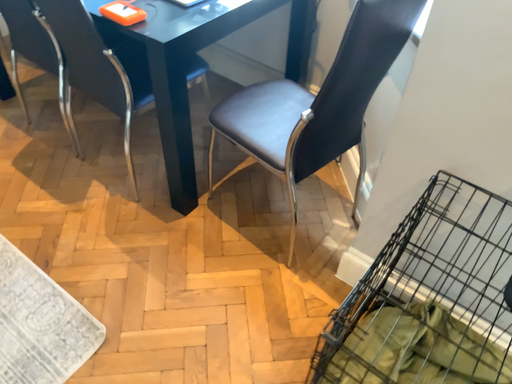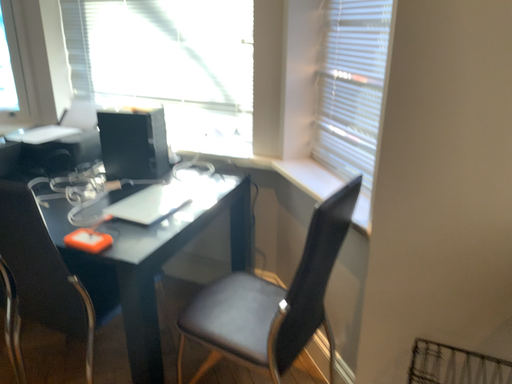
Question: How did the camera likely rotate when shooting the video?

Choices:
 (A) rotated upward
 (B) rotated downward

Answer: (A)